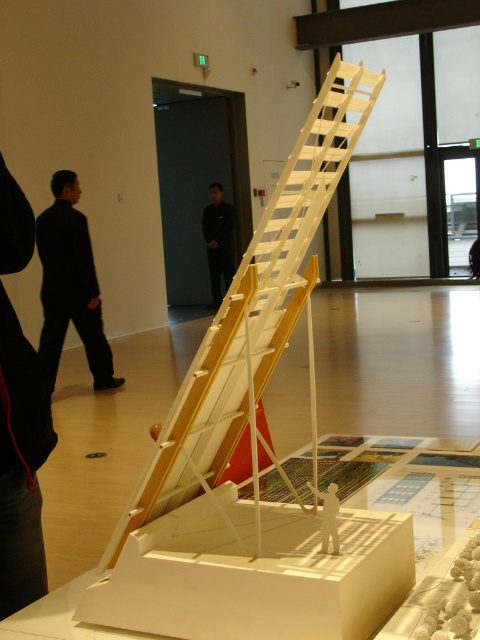
Question: Estimate the real-world distances between objects in this image. Which object is closer to the black fabric at left?

Choices:
 (A) black suit at left
 (B) black smooth suit at center
 (C) white matte ladder at center

Answer: (C)

Question: Can you confirm if white matte ladder at center is thinner than black smooth suit at center?

Choices:
 (A) yes
 (B) no

Answer: (B)

Question: Is white matte ladder at center further to camera compared to black smooth suit at center?

Choices:
 (A) yes
 (B) no

Answer: (B)

Question: Based on their relative distances, which object is nearer to the white matte ladder at center?

Choices:
 (A) black suit at left
 (B) black smooth suit at center
 (C) black fabric at left

Answer: (C)

Question: Which object is positioned closest to the black fabric at left?

Choices:
 (A) black suit at left
 (B) black smooth suit at center
 (C) white matte ladder at center

Answer: (C)

Question: Does white matte ladder at center come in front of black smooth suit at center?

Choices:
 (A) no
 (B) yes

Answer: (B)